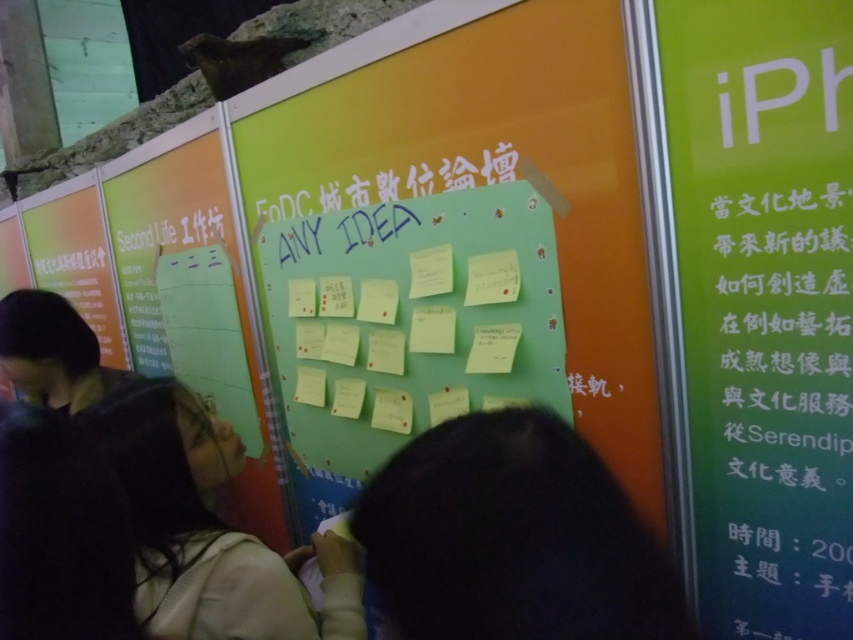
You are a photographer holding a camera and want to take a clear photo of the green matte bulletin board at center. What is the minimum distance you need to be from the camera to ensure the board is in focus?

The minimum distance you need to be from the camera is 1.14 meters to ensure the green matte bulletin board at center is in focus since the board and the camera are 1.14 meters apart.

You are organizing a poster session and need to display two items. You have a green paper at right and a green matte bulletin board at center. Which item has a smaller width?

The green paper at right has a smaller width than the green matte bulletin board at center.

You are attending a conference and want to present your idea on the green matte bulletin board at center. However, you notice a light beige sweater at center nearby. Considering their heights, which object is more suitable to place your presentation materials on?

The green matte bulletin board at center is taller than the light beige sweater at center, so the green matte bulletin board at center is more suitable to place your presentation materials on.